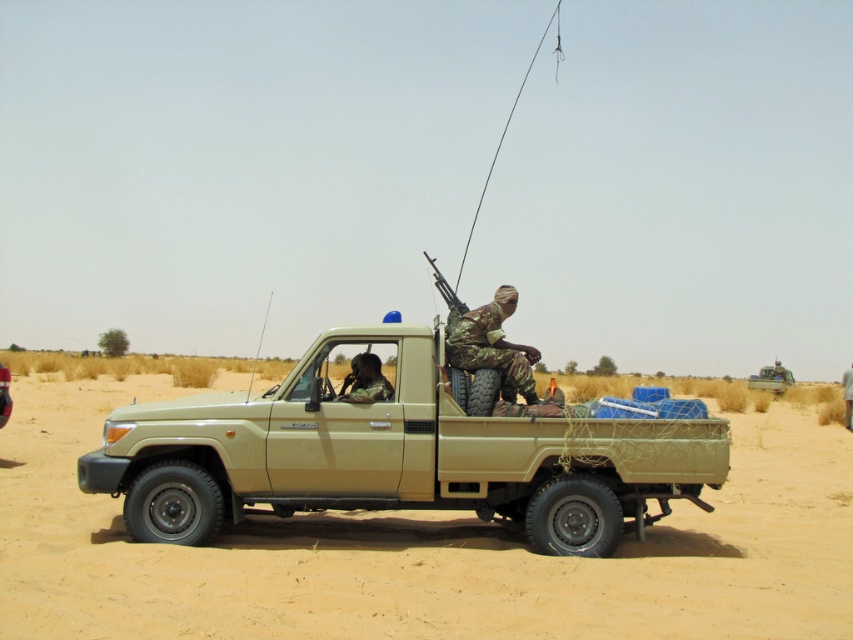
Question: Which object is farther from the camera taking this photo?

Choices:
 (A) camouflage fabric uniform at center
 (B) matte khaki truck at center

Answer: (B)

Question: Is sandy beige dirt field at center further to camera compared to matte khaki truck at center?

Choices:
 (A) yes
 (B) no

Answer: (B)

Question: Does matte khaki truck at center have a greater width compared to camouflage fabric uniform at center?

Choices:
 (A) no
 (B) yes

Answer: (A)

Question: Which of these objects is positioned closest to the camouflage fabric uniform at center?

Choices:
 (A) camouflage fabric helmet at center
 (B) sandy beige dirt field at center

Answer: (A)

Question: Among these objects, which one is farthest from the camera?

Choices:
 (A) sandy beige dirt field at center
 (B) camouflage fabric helmet at center
 (C) camouflage fabric uniform at center

Answer: (C)

Question: Does matte khaki truck at center appear on the right side of camouflage fabric uniform at center?

Choices:
 (A) no
 (B) yes

Answer: (B)